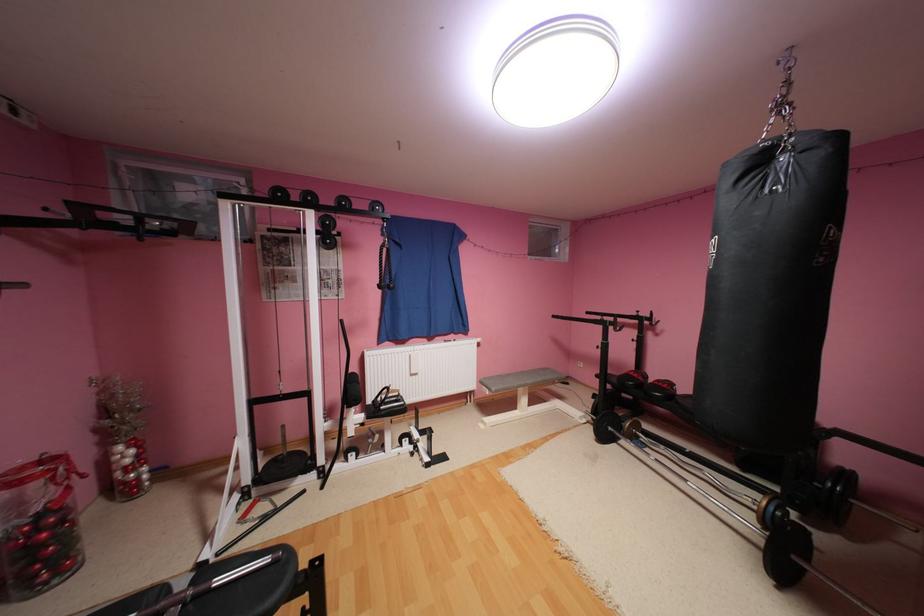
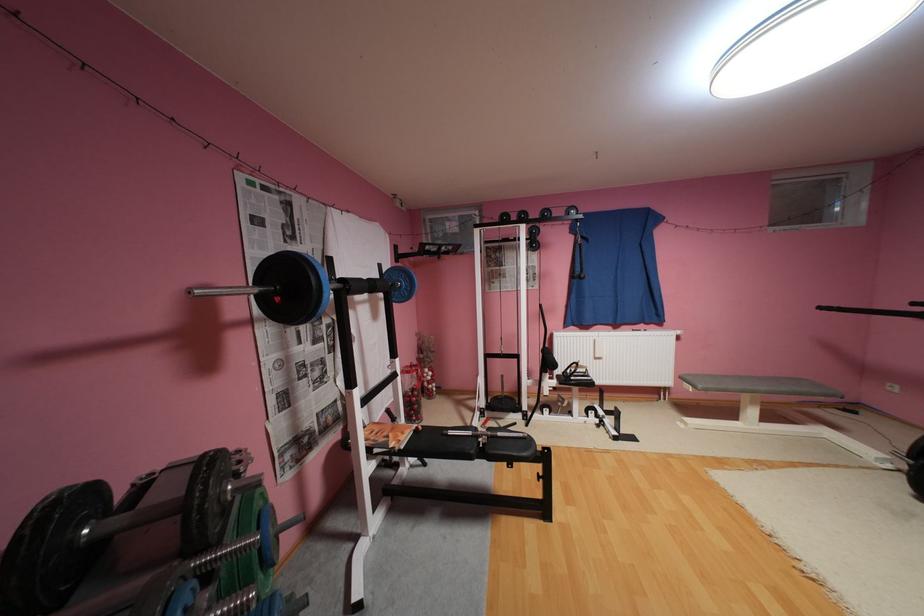
Locate, in the second image, the point that corresponds to point 538,382 in the first image.

(771, 387)